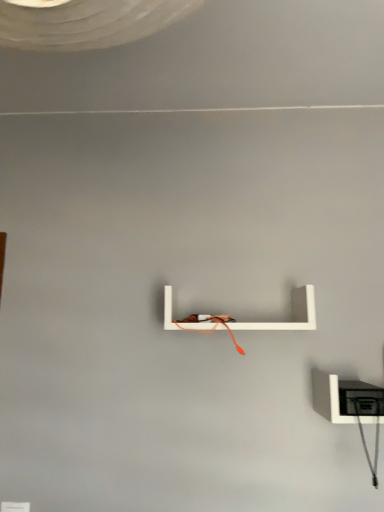
Question: Should I look upward or downward to see white matte shelf at center, the second shelf when ordered from right to left?

Choices:
 (A) up
 (B) down

Answer: (B)

Question: Does white matte shelf at lower right, which appears as the 2th shelf when viewed from the left, have a larger size compared to white matte shelf at center, which appears as the second shelf when ordered from the bottom?

Choices:
 (A) yes
 (B) no

Answer: (B)

Question: From the image's perspective, is white matte shelf at lower right, the 2th shelf from the top, over white matte shelf at center, the second shelf when ordered from right to left?

Choices:
 (A) yes
 (B) no

Answer: (B)

Question: Considering the relative positions of white matte shelf at lower right, which appears as the 2th shelf when viewed from the left, and white matte shelf at center, the first shelf in the left-to-right sequence, in the image provided, is white matte shelf at lower right, which appears as the 2th shelf when viewed from the left, to the left of white matte shelf at center, the first shelf in the left-to-right sequence, from the viewer's perspective?

Choices:
 (A) no
 (B) yes

Answer: (A)

Question: Is white matte shelf at lower right, which appears as the 2th shelf when viewed from the left, outside of white matte shelf at center, which appears as the second shelf when ordered from the bottom?

Choices:
 (A) no
 (B) yes

Answer: (B)

Question: Are white matte shelf at lower right, marked as the first shelf in a right-to-left arrangement, and white matte shelf at center, the first shelf when ordered from top to bottom, far apart?

Choices:
 (A) yes
 (B) no

Answer: (B)

Question: Considering the relative sizes of white matte shelf at lower right, which appears as the 2th shelf when viewed from the left, and white matte shelf at center, the first shelf in the left-to-right sequence, in the image provided, is white matte shelf at lower right, which appears as the 2th shelf when viewed from the left, taller than white matte shelf at center, the first shelf in the left-to-right sequence,?

Choices:
 (A) yes
 (B) no

Answer: (B)

Question: Does white matte shelf at center, which appears as the second shelf when ordered from the bottom, have a greater height compared to white matte shelf at lower right, which appears as the 2th shelf when viewed from the left?

Choices:
 (A) no
 (B) yes

Answer: (B)

Question: Is white matte shelf at center, the second shelf when ordered from right to left, wider than white matte shelf at lower right, marked as the first shelf in a right-to-left arrangement?

Choices:
 (A) yes
 (B) no

Answer: (B)

Question: Does white matte shelf at center, the second shelf when ordered from right to left, have a larger size compared to white matte shelf at lower right, which appears as the 2th shelf when viewed from the left?

Choices:
 (A) no
 (B) yes

Answer: (B)

Question: From the image's perspective, is white matte shelf at center, the first shelf in the left-to-right sequence, on top of white matte shelf at lower right, which appears as the 2th shelf when viewed from the left?

Choices:
 (A) yes
 (B) no

Answer: (A)

Question: From the image's perspective, does white matte shelf at center, which appears as the second shelf when ordered from the bottom, appear lower than white matte shelf at lower right, marked as the first shelf in a right-to-left arrangement?

Choices:
 (A) yes
 (B) no

Answer: (B)

Question: Is the depth of white matte shelf at center, the first shelf in the left-to-right sequence, less than that of white matte shelf at lower right, arranged as the 1th shelf when ordered from the bottom?

Choices:
 (A) no
 (B) yes

Answer: (A)

Question: Looking at their shapes, would you say white matte shelf at lower right, the 2th shelf from the top, is wider or thinner than white matte shelf at center, the first shelf in the left-to-right sequence?

Choices:
 (A) thin
 (B) wide

Answer: (B)